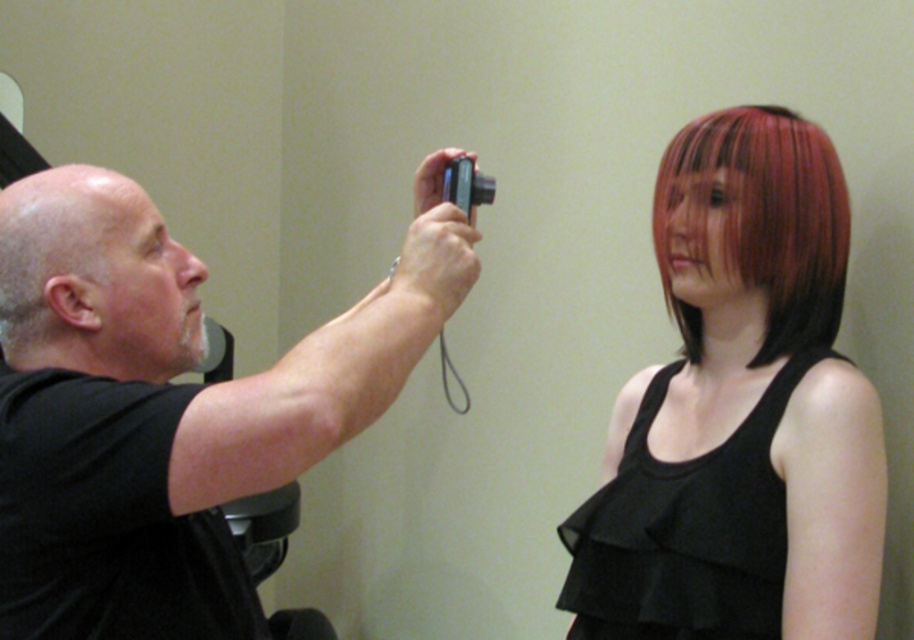
The width and height of the screenshot is (914, 640). Identify the location of black matte camera at upper left. (317, 374).

Is black matte camera at upper left positioned behind shiny red hair at right?

No, black matte camera at upper left is in front of shiny red hair at right.

Who is more distant from viewer, (190, 304) or (727, 208)?

The point (727, 208) is more distant.

Find the location of a particular element. The width and height of the screenshot is (914, 640). black matte camera at upper left is located at coordinates (317, 374).

Can you confirm if shiny red hair at upper right is positioned to the right of shiny red hair at right?

Incorrect, shiny red hair at upper right is not on the right side of shiny red hair at right.

Between shiny red hair at upper right and shiny red hair at right, which one has less height?

With less height is shiny red hair at right.

The width and height of the screenshot is (914, 640). Identify the location of shiny red hair at upper right. (740, 412).

Does shiny red hair at upper right appear on the left side of black matte camera at upper left?

No, shiny red hair at upper right is not to the left of black matte camera at upper left.

Which is in front, point (692, 554) or point (128, 454)?

Positioned in front is point (128, 454).

Is point (834, 440) positioned behind point (39, 176)?

Yes, it is.

At what (x,y) coordinates should I click in order to perform the action: click on shiny red hair at upper right. Please return your answer as a coordinate pair (x, y). This screenshot has width=914, height=640. Looking at the image, I should click on pos(740,412).